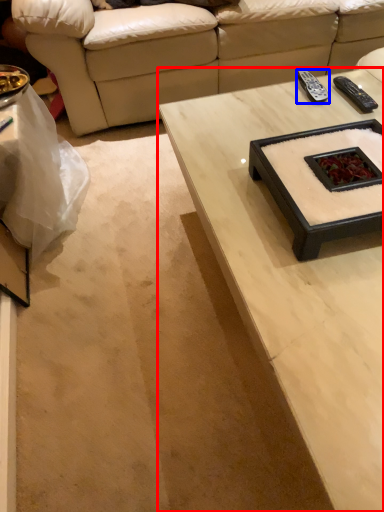
Question: Which point is further to the camera, coffee table (highlighted by a red box) or remote (highlighted by a blue box)?

Choices:
 (A) coffee table
 (B) remote

Answer: (B)